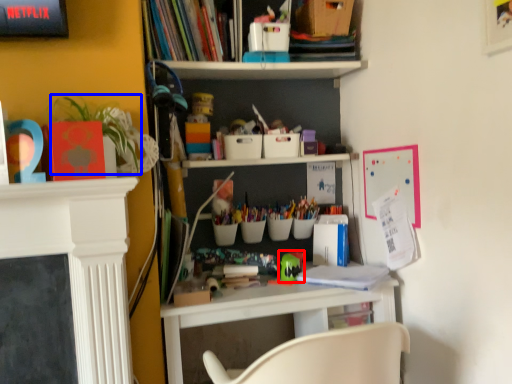
Question: Which object is closer to the camera taking this photo, toy (highlighted by a red box) or plant (highlighted by a blue box)?

Choices:
 (A) toy
 (B) plant

Answer: (B)